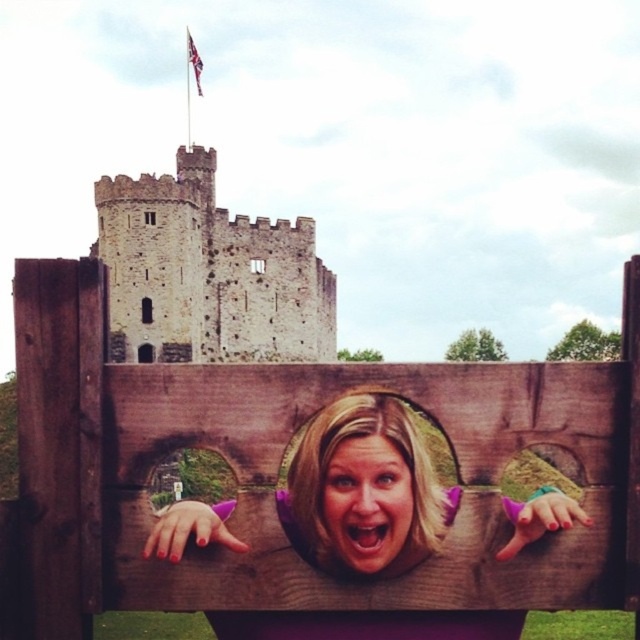
You are a photographer adjusting the lighting for a portrait. The subject has smooth blonde hair at center and smooth skin face at center. Which object should you focus on if you want to ensure the widest part of the subject is properly lit?

The smooth blonde hair at center might be wider than smooth skin face at center, so you should focus on the smooth blonde hair at center to ensure the widest part is properly lit.

You are a photographer standing at the camera position. You want to take a photo of the stone medieval tower at upper left. However, your camera has a maximum zoom range of 40 meters. Can you capture the tower clearly without moving closer?

The stone medieval tower at upper left is 46.62 meters away from the camera. Since the camera can only zoom up to 40 meters, you cannot capture the tower clearly without moving closer.